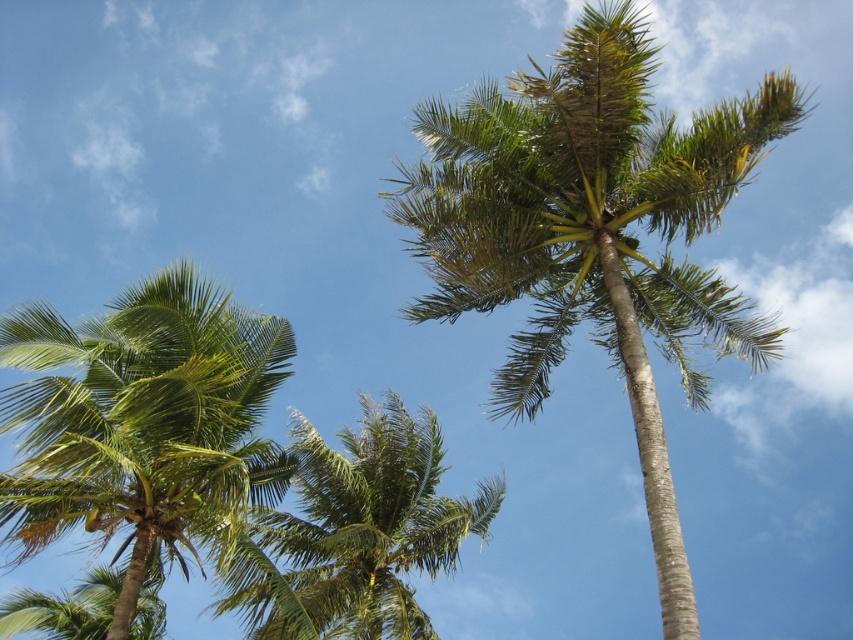
You are standing at the base of the palm trees in the image. Which tree is higher up in the frame, the green leafy palm tree at upper center or the green leafy coconut tree at center?

The green leafy palm tree at upper center is higher up in the frame than the green leafy coconut tree at center.

You are standing under the palm trees looking up. Which palm tree, the green leafy palm tree at upper center or the green leafy palm tree at left, is closer to you?

The green leafy palm tree at upper center is closer to you because it is in front of the green leafy palm tree at left.

You are a bird that can fly 10 meters high. You want to fly between the green leafy palm tree at upper center and the green leafy coconut tree at center. Can you do it?

The distance between the green leafy palm tree at upper center and the green leafy coconut tree at center is 12.70 meters. Since the bird can only fly up to 10 meters high, it cannot cover the required distance of 12.70 meters between them.